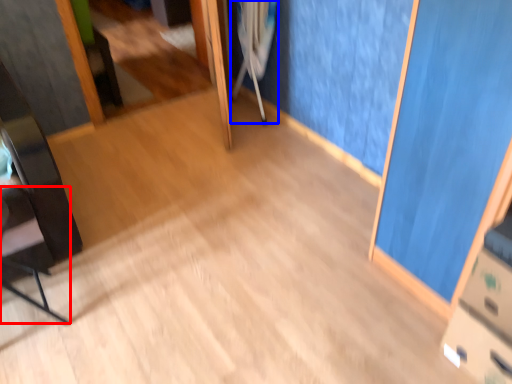
Question: Which of the following is the closest to the observer, chair (highlighted by a red box) or crutch (highlighted by a blue box)?

Choices:
 (A) chair
 (B) crutch

Answer: (A)